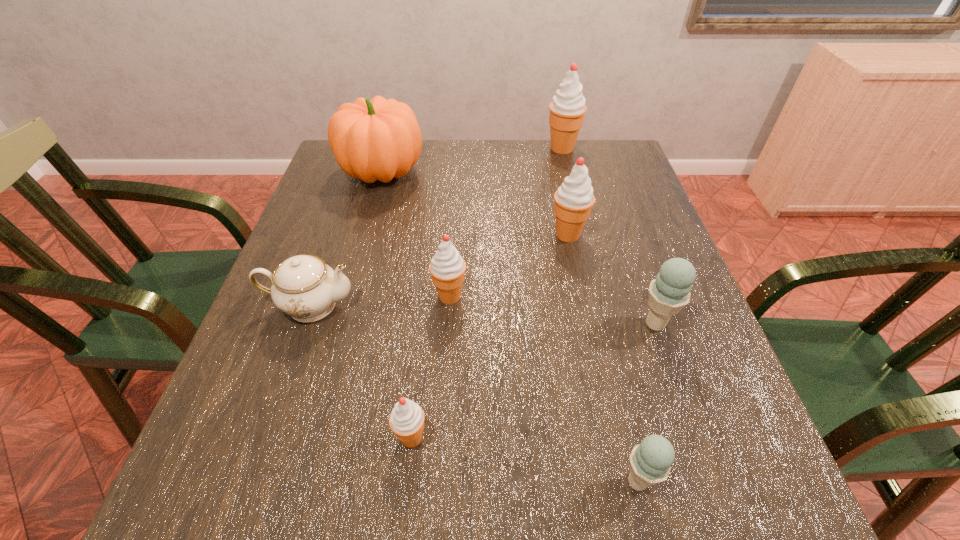
Where is `unoccupied area between the nearest object and the chinaware`? This screenshot has height=540, width=960. unoccupied area between the nearest object and the chinaware is located at coordinates (x=474, y=393).

The height and width of the screenshot is (540, 960). What are the coordinates of `free space between the chinaware and the smaller blue ice cream` in the screenshot? It's located at (474, 393).

Find the location of a particular element. The image size is (960, 540). empty space between the third biggest red icecream and the nearest ice cream is located at coordinates click(543, 389).

Identify the location of empty space that is in between the farthest ice cream and the right blue ice cream. This screenshot has width=960, height=540. (609, 236).

I want to click on vacant region between the pumpkin and the fifth farthest ice cream, so click(x=396, y=305).

Select which object is the sixth closest to the right blue ice cream. Please provide its 2D coordinates. Your answer should be formatted as a tuple, i.e. [(x, y)], where the tuple contains the x and y coordinates of a point satisfying the conditions above.

[(567, 109)]

The height and width of the screenshot is (540, 960). Identify the location of object that ranks as the sixth closest to the second smallest red icecream. (650, 462).

Locate which ice cream ranks second in proximity to the tallest object. Please provide its 2D coordinates. Your answer should be formatted as a tuple, i.e. [(x, y)], where the tuple contains the x and y coordinates of a point satisfying the conditions above.

[(447, 267)]

Select which ice cream is the fourth closest to the third farthest red icecream. Please provide its 2D coordinates. Your answer should be formatted as a tuple, i.e. [(x, y)], where the tuple contains the x and y coordinates of a point satisfying the conditions above.

[(650, 462)]

Identify the location of red icecream that is the third closest to the second farthest red icecream. This screenshot has width=960, height=540. (406, 420).